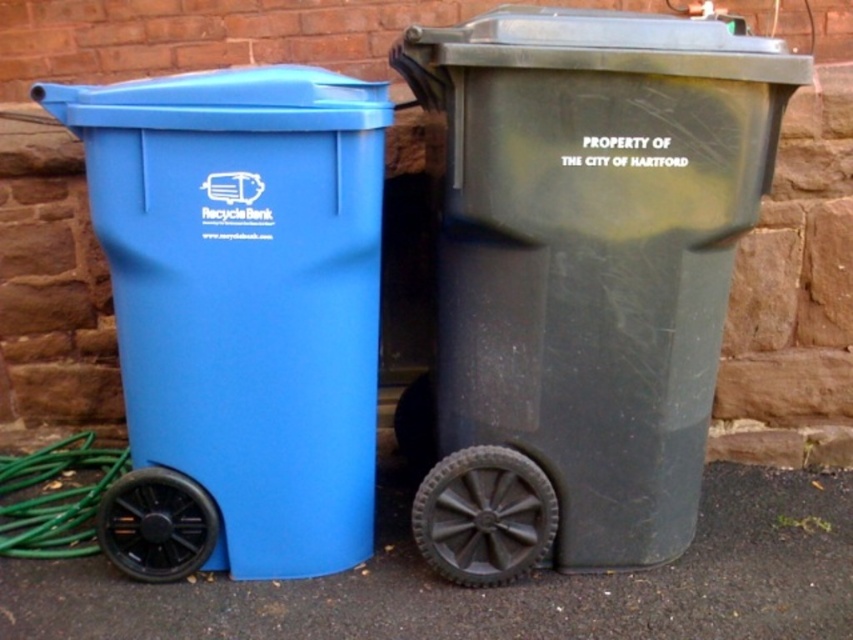
Which is more to the right, black rubber wheel at lower center or green rubber garden hose at lower left?

From the viewer's perspective, black rubber wheel at lower center appears more on the right side.

This screenshot has height=640, width=853. Describe the element at coordinates (485, 516) in the screenshot. I see `black rubber wheel at lower center` at that location.

Locate an element on the screen. The height and width of the screenshot is (640, 853). black rubber wheel at lower center is located at coordinates (485, 516).

Is matte black trash can at right positioned at the back of matte plastic recycling bin at left?

That is False.

What do you see at coordinates (584, 275) in the screenshot?
I see `matte black trash can at right` at bounding box center [584, 275].

Where is `matte black trash can at right`? The width and height of the screenshot is (853, 640). matte black trash can at right is located at coordinates (584, 275).

Looking at this image, is matte black trash can at right closer to the viewer compared to black rubber wheel at lower center?

That is True.

Does matte black trash can at right have a lesser width compared to black rubber wheel at lower center?

Incorrect, matte black trash can at right's width is not less than black rubber wheel at lower center's.

Describe the element at coordinates (584, 275) in the screenshot. The width and height of the screenshot is (853, 640). I see `matte black trash can at right` at that location.

Locate an element on the screen. matte black trash can at right is located at coordinates (584, 275).